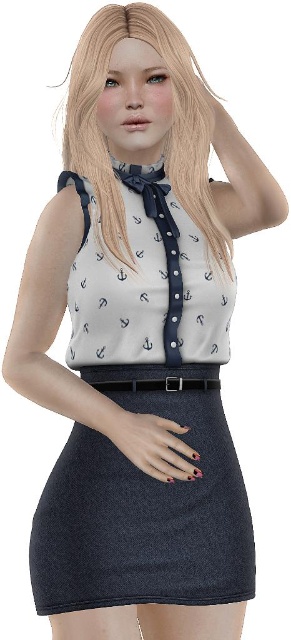
Does blondehair at upper center have a lesser width compared to black leather belt at center?

No, blondehair at upper center is not thinner than black leather belt at center.

Identify the location of blondehair at upper center. The width and height of the screenshot is (291, 640). (169, 132).

This screenshot has height=640, width=291. Identify the location of blondehair at upper center. (169, 132).

This screenshot has width=291, height=640. What do you see at coordinates (162, 244) in the screenshot?
I see `navy blue satin bow tie at center` at bounding box center [162, 244].

Who is lower down, navy blue satin bow tie at center or black leather belt at center?

Positioned lower is black leather belt at center.

Find the location of `navy blue satin bow tie at center`. navy blue satin bow tie at center is located at coordinates (162, 244).

Is denim skirt at lower center thinner than navy blue satin bow tie at center?

No, denim skirt at lower center is not thinner than navy blue satin bow tie at center.

Consider the image. Can you confirm if denim skirt at lower center is smaller than navy blue satin bow tie at center?

Actually, denim skirt at lower center might be larger than navy blue satin bow tie at center.

Identify the location of denim skirt at lower center. This screenshot has height=640, width=291. (144, 518).